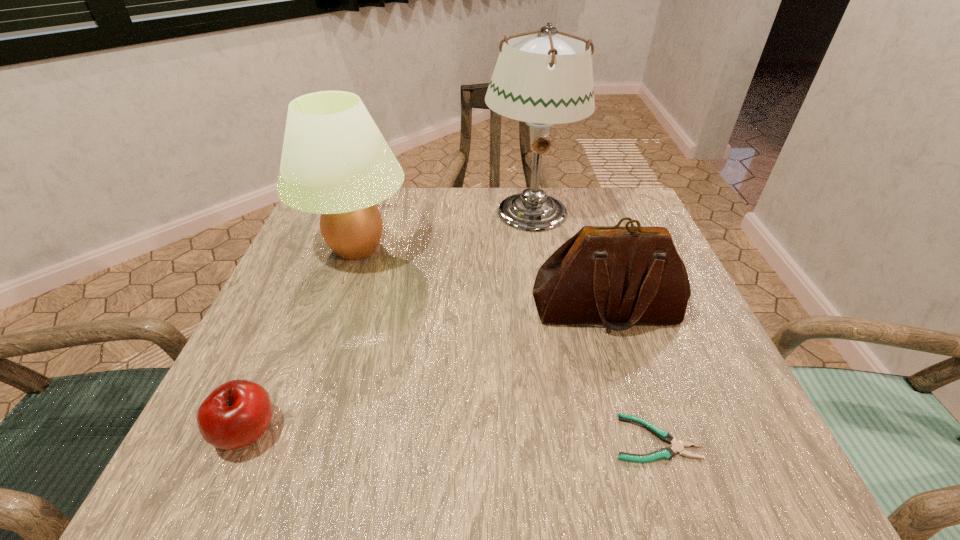
Where is `vacant space positioned on the right of the second shortest object`? The image size is (960, 540). vacant space positioned on the right of the second shortest object is located at coordinates (459, 431).

Find the location of a particular element. This screenshot has width=960, height=540. vacant space located 0.290m on the left of the pliers is located at coordinates (415, 438).

Where is `apple positioned at the near edge`? This screenshot has height=540, width=960. apple positioned at the near edge is located at coordinates (235, 414).

Where is `pliers located in the near edge section of the desktop`? The width and height of the screenshot is (960, 540). pliers located in the near edge section of the desktop is located at coordinates (667, 453).

Identify the location of lampshade located in the left edge section of the desktop. The width and height of the screenshot is (960, 540). pyautogui.click(x=335, y=162).

Locate an element on the screen. The image size is (960, 540). apple that is at the left edge is located at coordinates (235, 414).

Locate an element on the screen. Image resolution: width=960 pixels, height=540 pixels. shoulder bag that is positioned at the right edge is located at coordinates (621, 276).

Where is `pliers located at the right edge`? The image size is (960, 540). pliers located at the right edge is located at coordinates (667, 453).

At what (x,y) coordinates should I click in order to perform the action: click on object located at the far left corner. Please return your answer as a coordinate pair (x, y). This screenshot has height=540, width=960. Looking at the image, I should click on coord(335,162).

The width and height of the screenshot is (960, 540). In order to click on object at the near left corner in this screenshot , I will do `click(235, 414)`.